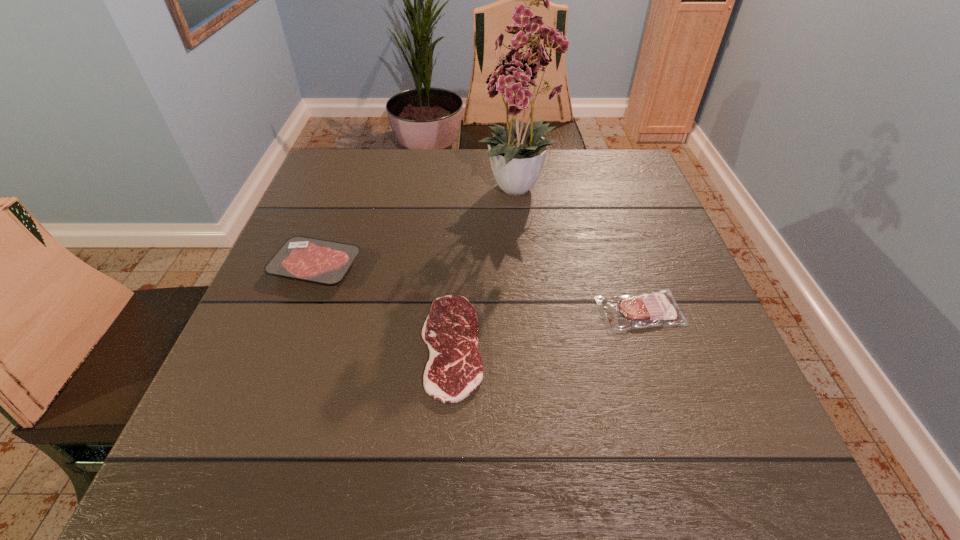
Locate an element on the screen. The width and height of the screenshot is (960, 540). blank area at the near right corner is located at coordinates (690, 490).

Find the location of a particular element. free space between the tallest steak and the tallest object is located at coordinates (418, 228).

Where is `free spot between the second shortest object and the shortest object`? free spot between the second shortest object and the shortest object is located at coordinates (546, 329).

Where is `free space between the farthest object and the third shortest object`? free space between the farthest object and the third shortest object is located at coordinates (418, 228).

In order to click on free spot between the shortest object and the second tallest object in this screenshot , I will do `click(384, 306)`.

At what (x,y) coordinates should I click in order to perform the action: click on free spot between the tallest steak and the rightmost steak. Please return your answer as a coordinate pair (x, y). The image size is (960, 540). Looking at the image, I should click on (478, 289).

The height and width of the screenshot is (540, 960). Find the location of `empty location between the flower arrangement and the tallest steak`. empty location between the flower arrangement and the tallest steak is located at coordinates (418, 228).

Where is `empty space that is in between the second steak from right to left and the flower arrangement`? The width and height of the screenshot is (960, 540). empty space that is in between the second steak from right to left and the flower arrangement is located at coordinates (486, 268).

Where is `vacant area between the tallest object and the second tallest object`? Image resolution: width=960 pixels, height=540 pixels. vacant area between the tallest object and the second tallest object is located at coordinates (418, 228).

I want to click on empty space that is in between the farthest object and the second steak from right to left, so pos(486,268).